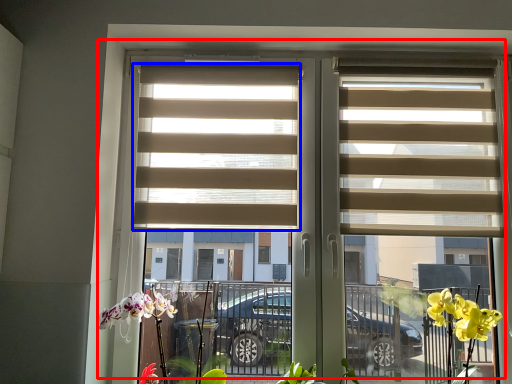
Question: Which point is further to the camera, window (highlighted by a red box) or window blind (highlighted by a blue box)?

Choices:
 (A) window
 (B) window blind

Answer: (B)